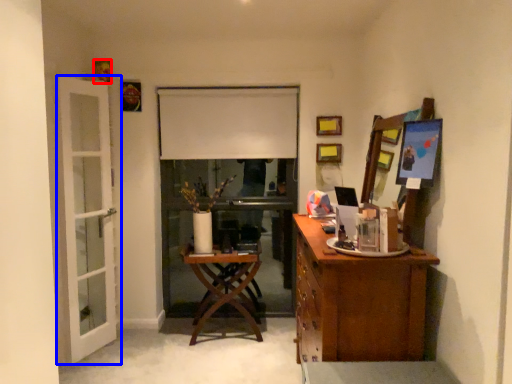
Question: Which point is closer to the camera, picture frame (highlighted by a red box) or door (highlighted by a blue box)?

Choices:
 (A) picture frame
 (B) door

Answer: (B)